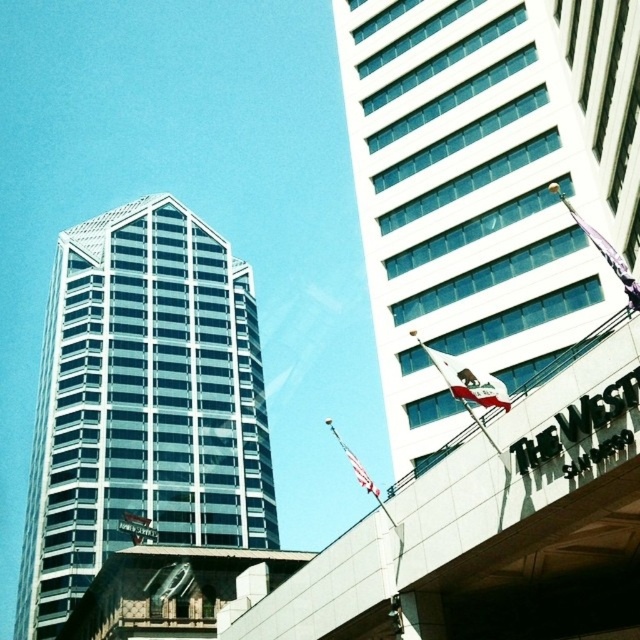
Is white glass building at upper right bigger than glassy steel tower at left?

No, white glass building at upper right is not bigger than glassy steel tower at left.

The height and width of the screenshot is (640, 640). Describe the element at coordinates (486, 182) in the screenshot. I see `white glass building at upper right` at that location.

Measure the distance between white glass building at upper right and camera.

white glass building at upper right and camera are 30.36 meters apart from each other.

Where is `white glass building at upper right`? white glass building at upper right is located at coordinates (486, 182).